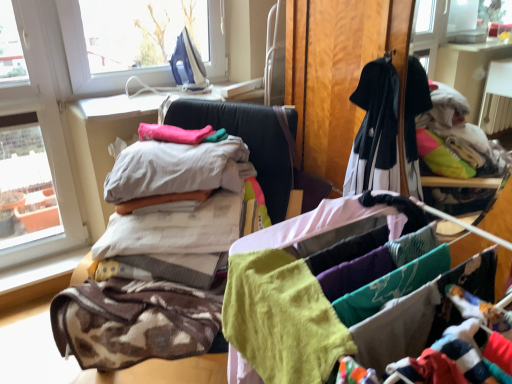
Question: Is white cotton sheets at center, which appears as the third baby clothe when viewed from the back, to the left or to the right of soft yellow fabric at center, positioned as the first baby clothe in front-to-back order, in the image?

Choices:
 (A) left
 (B) right

Answer: (A)

Question: Relative to soft yellow fabric at center, positioned as the first baby clothe in front-to-back order, is white cotton sheets at center, which is counted as the 3th baby clothe, starting from the front, in front or behind?

Choices:
 (A) front
 (B) behind

Answer: (B)

Question: Which of these objects is positioned closest to the soft yellow fabric at center, positioned as the first baby clothe in front-to-back order?

Choices:
 (A) white cotton sheets at center, which is counted as the 3th baby clothe, starting from the front
 (B) soft cotton towel at center
 (C) pink fabric at center, the 1th baby clothe in the back-to-front sequence
 (D) brown textured blanket at left, which is counted as the 4th baby clothe, starting from the back
 (E) soft cotton clothes at center, the fourth baby clothe viewed from the front

Answer: (B)

Question: Which object is the closest to the soft yellow fabric at center, marked as the 5th baby clothe in a back-to-front arrangement?

Choices:
 (A) white cotton bed at center
 (B) pink fabric at center, the 1th baby clothe in the back-to-front sequence
 (C) soft cotton clothes at center, the fourth baby clothe viewed from the front
 (D) brown textured blanket at left, positioned as the second baby clothe in front-to-back order
 (E) white cotton sheets at center, which appears as the third baby clothe when viewed from the back

Answer: (D)